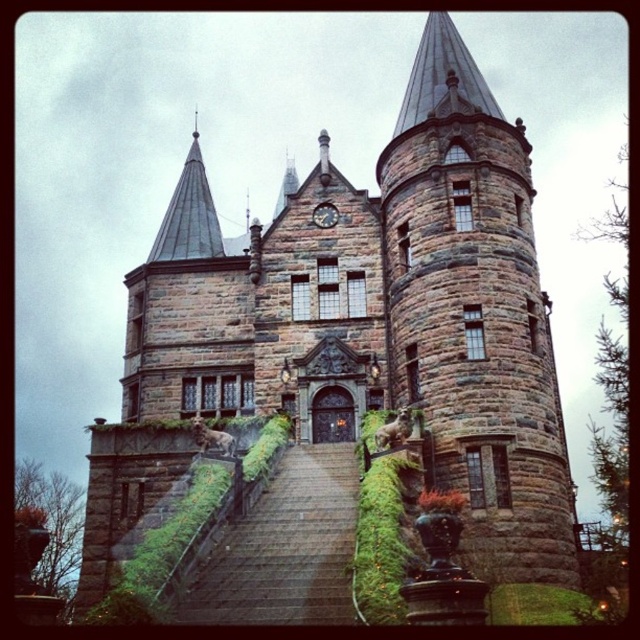
Can you confirm if brown stone tower at center is bigger than stone stairs at center?

Indeed, brown stone tower at center has a larger size compared to stone stairs at center.

Which is in front, point (557, 518) or point (321, 547)?

Point (321, 547)

At what (x,y) coordinates should I click in order to perform the action: click on brown stone tower at center. Please return your answer as a coordinate pair (x, y). Looking at the image, I should click on (474, 314).